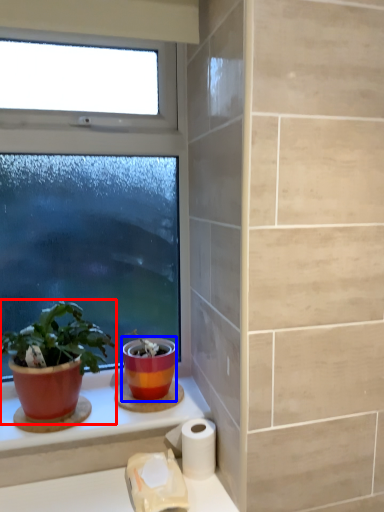
Question: Which object appears closest to the camera in this image, houseplant (highlighted by a red box) or flowerpot (highlighted by a blue box)?

Choices:
 (A) houseplant
 (B) flowerpot

Answer: (A)